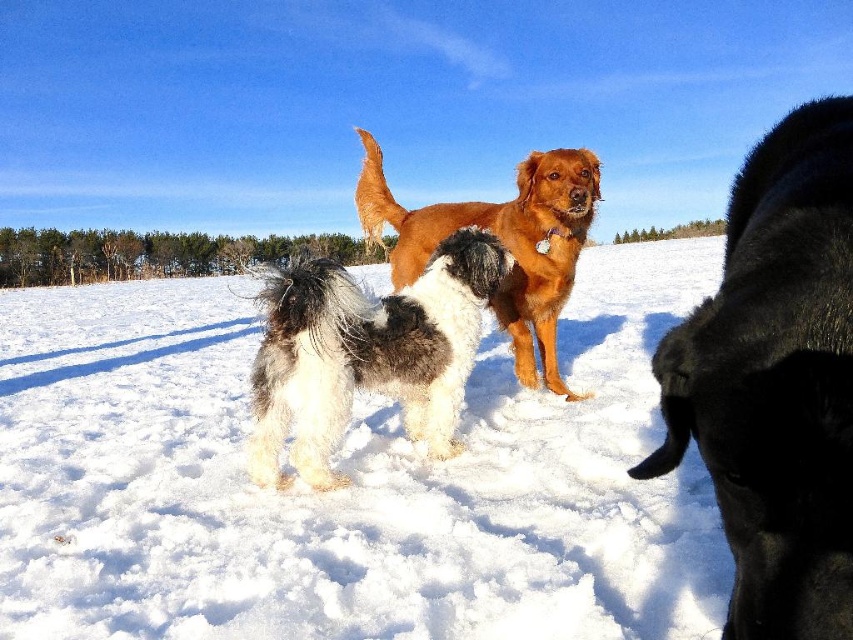
Question: Which object is farther from the camera taking this photo?

Choices:
 (A) fluffy white and black dog at center
 (B) white fluffy snow at center
 (C) golden brown fur at center

Answer: (C)

Question: Can you confirm if black fur dog at right is positioned to the left of golden brown fur at center?

Choices:
 (A) no
 (B) yes

Answer: (A)

Question: Is black fur dog at right positioned before golden brown fur at center?

Choices:
 (A) no
 (B) yes

Answer: (B)

Question: Among these points, which one is nearest to the camera?

Choices:
 (A) (109, 618)
 (B) (843, 317)

Answer: (B)

Question: Which point appears closest to the camera in this image?

Choices:
 (A) (607, 572)
 (B) (805, 493)
 (C) (529, 310)

Answer: (B)

Question: Is black fur dog at right closer to the viewer compared to fluffy white and black dog at center?

Choices:
 (A) yes
 (B) no

Answer: (A)